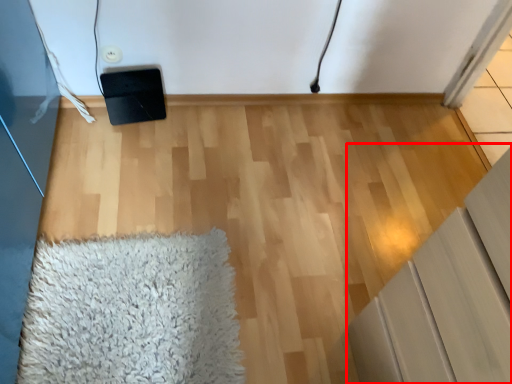
Question: From the image's perspective, what is the correct spatial relationship of furniture (annotated by the red box) in relation to mat?

Choices:
 (A) below
 (B) above

Answer: (B)